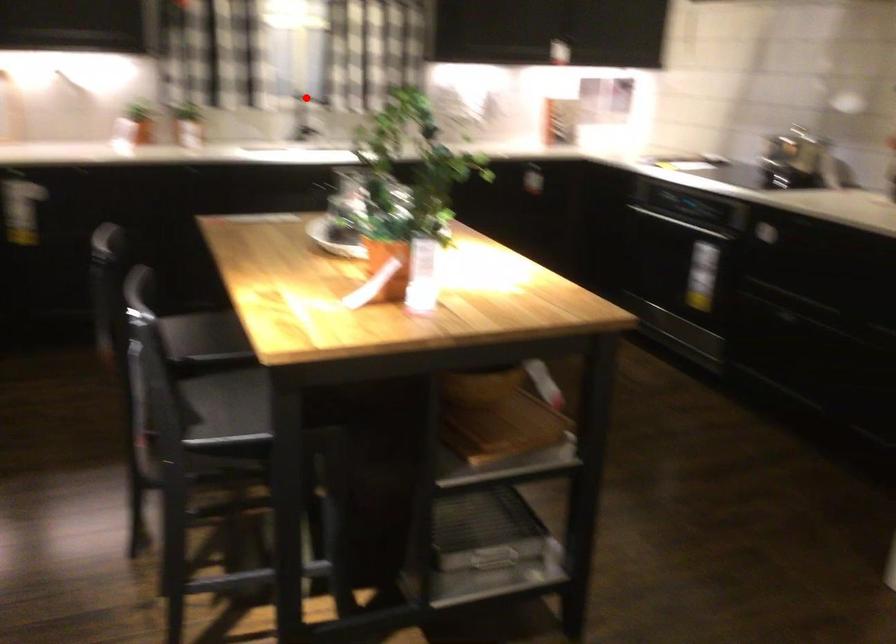
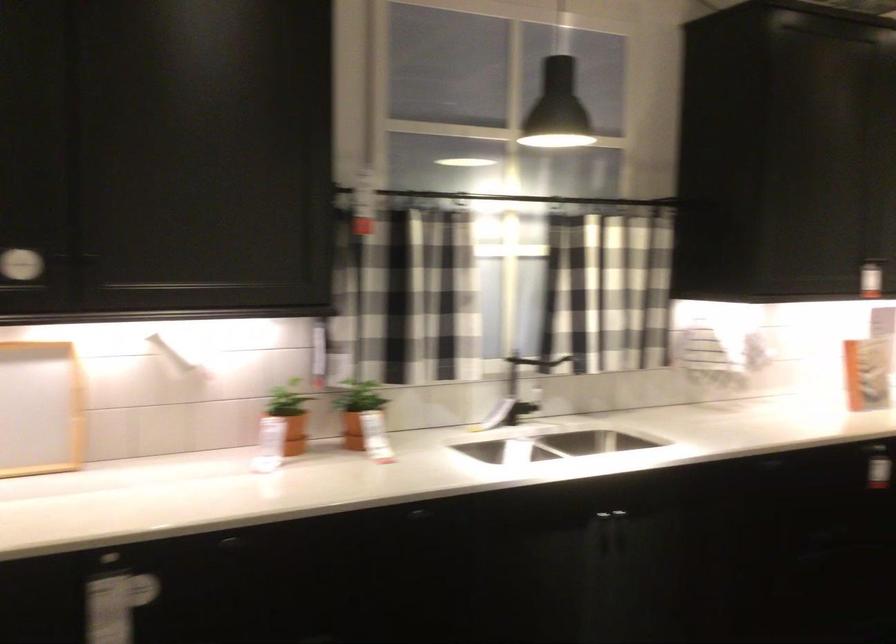
Question: I am providing you with two images of the same scene from different viewpoints. Image1 has a red point marked. In image2, the corresponding 3D location appears at what relative position? Reply with the corresponding letter.

Choices:
 (A) Closer
 (B) Farther

Answer: (A)